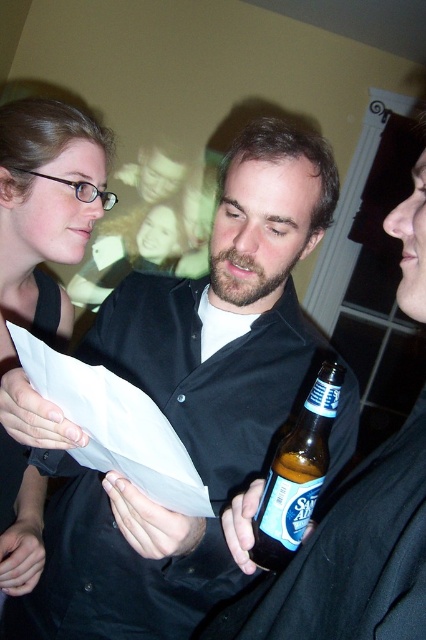
You are standing in the room and want to place a small decorative item on the closest point between point (218, 518) and point (34, 170). Which point should you choose?

Point (218, 518) is closer to the viewer than point (34, 170), so you should place the item on point (218, 518).

You are a photographer trying to capture a candid shot of the matte black shirt at center without being noticed. The camera you are using has a focal length of 50mm and requires a minimum distance of 24 inches to focus properly. Can you take the photo from your current position?

The matte black shirt at center and camera are 24.80 inches apart. Since 24.80 inches is greater than the minimum required 24 inches, you can take the photo from your current position.